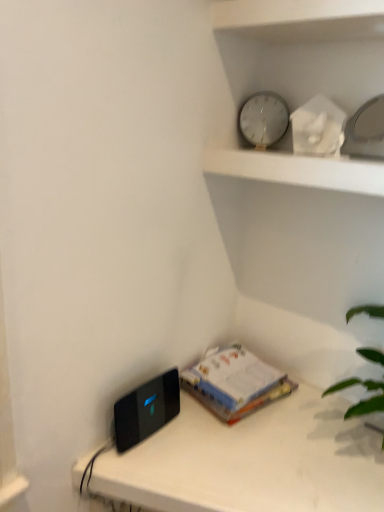
Question: Is black glossy ipod at lower left oriented towards white glass clock at upper center?

Choices:
 (A) yes
 (B) no

Answer: (B)

Question: Considering the relative positions of black glossy ipod at lower left and white glass clock at upper center in the image provided, is black glossy ipod at lower left to the left of white glass clock at upper center from the viewer's perspective?

Choices:
 (A) yes
 (B) no

Answer: (A)

Question: Is white glass clock at upper center a part of black glossy ipod at lower left?

Choices:
 (A) no
 (B) yes

Answer: (A)

Question: Does black glossy ipod at lower left have a lesser height compared to white glass clock at upper center?

Choices:
 (A) no
 (B) yes

Answer: (B)

Question: Does black glossy ipod at lower left have a larger size compared to white glass clock at upper center?

Choices:
 (A) no
 (B) yes

Answer: (A)

Question: Is black glossy ipod at lower left located outside white glass clock at upper center?

Choices:
 (A) no
 (B) yes

Answer: (B)

Question: From a real-world perspective, is black plastic device at lower left physically below white paper at center?

Choices:
 (A) yes
 (B) no

Answer: (A)

Question: Considering the relative sizes of black plastic device at lower left and white paper at center in the image provided, is black plastic device at lower left shorter than white paper at center?

Choices:
 (A) yes
 (B) no

Answer: (B)

Question: From a real-world perspective, is black plastic device at lower left on top of white paper at center?

Choices:
 (A) yes
 (B) no

Answer: (B)

Question: Can we say black plastic device at lower left lies outside white paper at center?

Choices:
 (A) no
 (B) yes

Answer: (B)

Question: Can you confirm if black plastic device at lower left is positioned to the left of white paper at center?

Choices:
 (A) no
 (B) yes

Answer: (A)

Question: Is black plastic device at lower left smaller than white paper at center?

Choices:
 (A) no
 (B) yes

Answer: (A)

Question: Is the depth of black glossy ipod at lower left less than that of white paper at center?

Choices:
 (A) no
 (B) yes

Answer: (B)